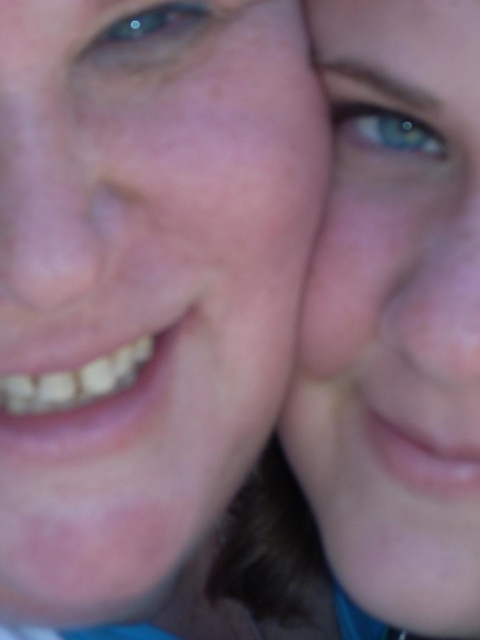
You are a photographer trying to capture a close portrait of two people. The subjects have smooth skin at center and blue matte skin at upper right. You want to ensure that both faces are in focus. Given that your camera can only focus sharply on objects within a 3 inch range, will both subjects be in focus?

The smooth skin at center and blue matte skin at upper right are 3.64 inches apart from each other. Since the camera can only focus sharply within a 3 inch range, the subjects are slightly outside this range. Therefore, both subjects cannot be in focus simultaneously.

You are a photographer reviewing a photo of two people. The photo has a point marked at coordinates point (x=143, y=282). Based on the scene description, what does this point likely represent?

The point (x=143, y=282) marks smooth skin at center, which is likely the area of the person in the foreground with fair skin and visible freckles, as their face is more prominently in the foreground and the point is at the center of the image.

You are a photographer using a camera with a focal length of 50mm. You want to ensure that the smooth skin at center is in sharp focus while keeping the background slightly blurred. Given the current setup, what adjustment can you make to the camera settings to achieve this effect?

To achieve a blurred background while keeping the smooth skin at center in focus, you can use a wider aperture setting on your camera. This will create a shallower depth of field, which helps in blurring the background while keeping the subject sharp.